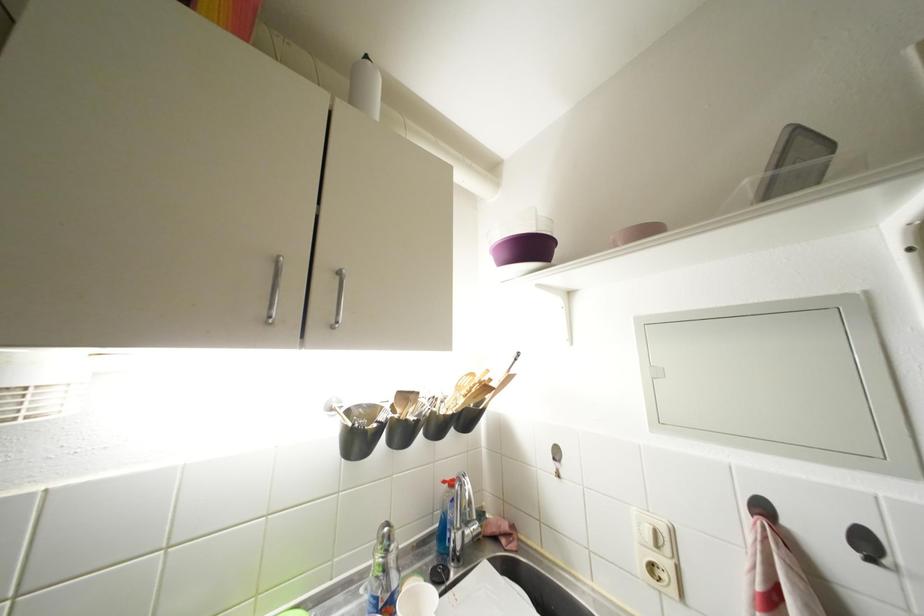
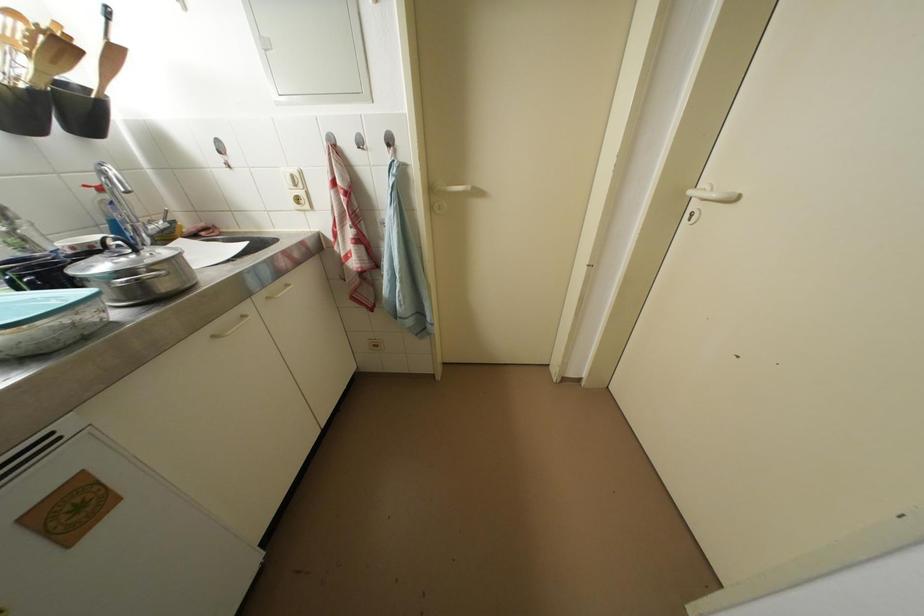
Locate, in the second image, the point that corresponds to pixel 473 536 in the first image.

(157, 231)